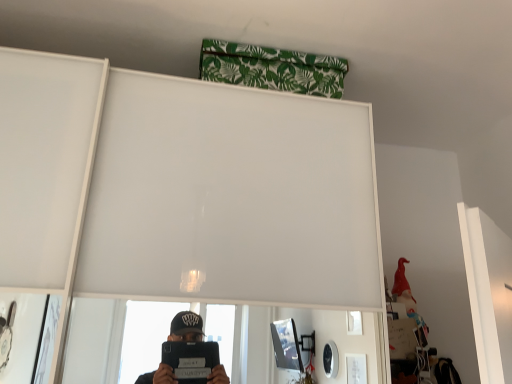
Question: In which direction should I rotate to look at green leaf-patterned fabric at upper center?

Choices:
 (A) left
 (B) right

Answer: (B)